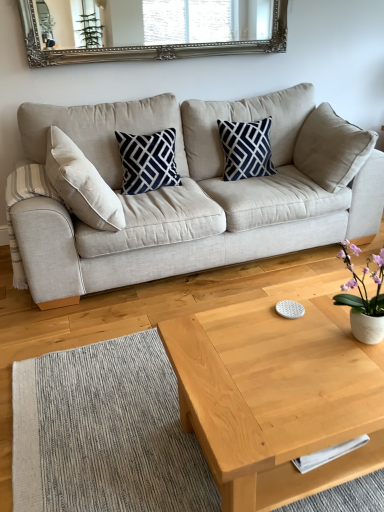
Question: Looking at their shapes, would you say beige fabric couch at center is wider or thinner than light wood/texture coffee table at center?

Choices:
 (A) wide
 (B) thin

Answer: (A)

Question: Is beige fabric couch at center bigger or smaller than light wood/texture coffee table at center?

Choices:
 (A) big
 (B) small

Answer: (A)

Question: Estimate the real-world distances between objects in this image. Which object is closer to the silver/gilded mirror at upper center?

Choices:
 (A) white ceramic vase at right
 (B) light wood/texture coffee table at center
 (C) navy blue printed cushion at center, the 2th pillow positioned from the left
 (D) beige fabric couch at center
 (E) navy blue/white geometric pillow at center, which is the second pillow in right-to-left order

Answer: (C)

Question: Which object is positioned closest to the beige fabric couch at center?

Choices:
 (A) light wood/texture coffee table at center
 (B) white ceramic vase at right
 (C) silver/gilded mirror at upper center
 (D) navy blue/white geometric pillow at center, arranged as the 1th pillow when viewed from the left
 (E) navy blue printed cushion at center, the first pillow from the right

Answer: (D)